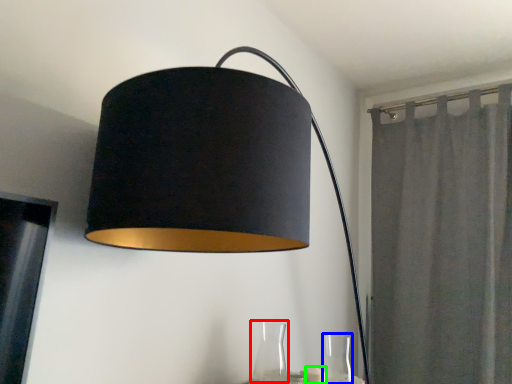
Question: Which object is the closest to the glass vase (highlighted by a red box)? Choose among these: glass vase (highlighted by a blue box) or candle (highlighted by a green box).

Choices:
 (A) glass vase
 (B) candle

Answer: (B)